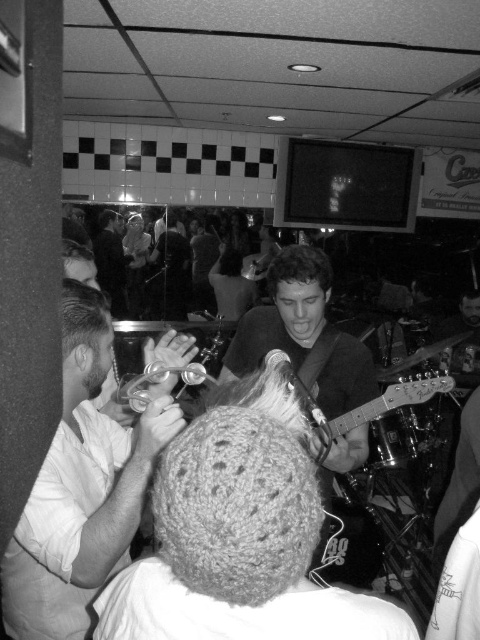
Question: Is white cotton shirt at left bigger than metallic silver guitar at center?

Choices:
 (A) yes
 (B) no

Answer: (A)

Question: Which point is farther to the camera?

Choices:
 (A) (393, 394)
 (B) (154, 417)

Answer: (A)

Question: Does white cotton shirt at left appear on the left side of metallic silver guitar at center?

Choices:
 (A) no
 (B) yes

Answer: (B)

Question: Which point is farther to the camera?

Choices:
 (A) metallic silver guitar at center
 (B) white cotton shirt at left

Answer: (A)

Question: Is white cotton shirt at left smaller than metallic silver guitar at center?

Choices:
 (A) yes
 (B) no

Answer: (B)

Question: Among these objects, which one is nearest to the camera?

Choices:
 (A) metallic silver guitar at center
 (B) white cotton shirt at left

Answer: (B)